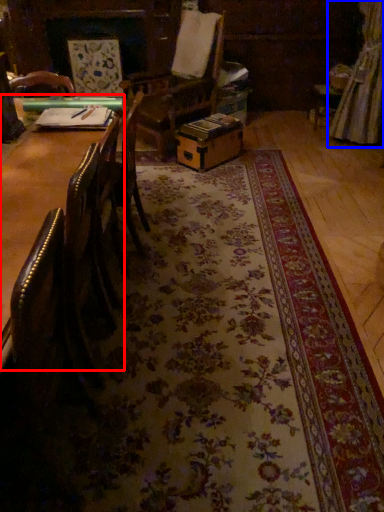
Question: Among these objects, which one is nearest to the camera, table (highlighted by a red box) or curtain (highlighted by a blue box)?

Choices:
 (A) table
 (B) curtain

Answer: (A)